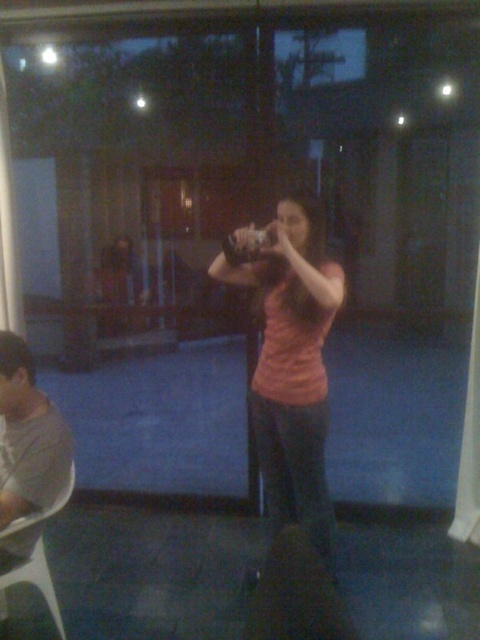
Based on the scene description, where is the pink matte shirt at center located in the image?

The pink matte shirt at center is located at point coordinates of 0.570 on the x axis and 0.610 on the y axis.

Based on the photo, you are a photographer trying to capture a clear photo of the pink matte shirt at center and the white plastic chair at lower left. Since the scene is blurry, you decide to adjust your camera settings to focus on the closer object. Which object should you focus on to ensure it becomes sharp?

The white plastic chair at lower left is closer to the photographer than the pink matte shirt at center. Since the scene is blurry, focusing on the closer object, the white plastic chair at lower left, would make it sharp.

Based on the photo, you are planning to take a photo of the scene. The pink matte shirt at center and the white plastic chair at lower left are both in the frame. Which object will appear bigger in your photo?

The pink matte shirt at center will appear bigger in the photo because it has a larger size compared to the white plastic chair at lower left.